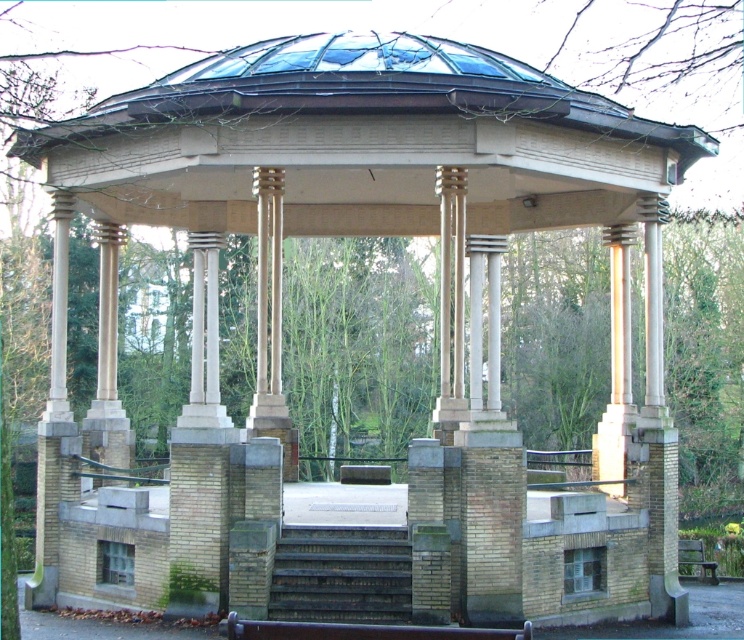
Between wooden bench at center and green wooden bench at lower right, which one appears on the right side from the viewer's perspective?

Positioned to the right is green wooden bench at lower right.

Between point (352, 625) and point (682, 547), which one is positioned in front?

Point (352, 625) is more forward.

Image resolution: width=744 pixels, height=640 pixels. What are the coordinates of `wooden bench at center` in the screenshot? It's located at (362, 630).